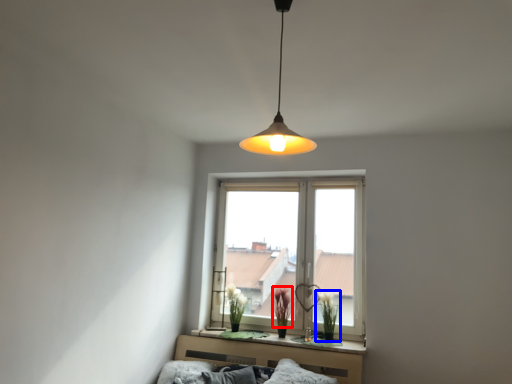
Question: Which point is closer to the camera, plant (highlighted by a red box) or plant (highlighted by a blue box)?

Choices:
 (A) plant
 (B) plant

Answer: (B)